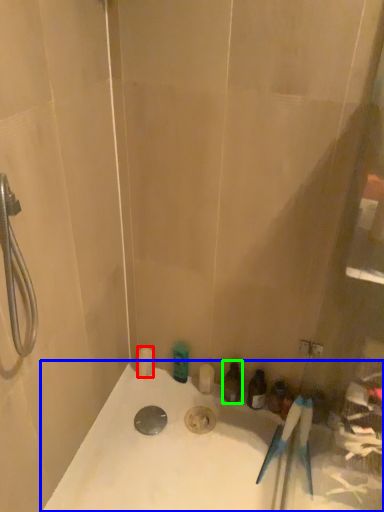
Question: Estimate the real-world distances between objects in this image. Which object is closer to toiletry (highlighted by a red box), bathtub (highlighted by a blue box) or toiletry (highlighted by a green box)?

Choices:
 (A) bathtub
 (B) toiletry

Answer: (B)